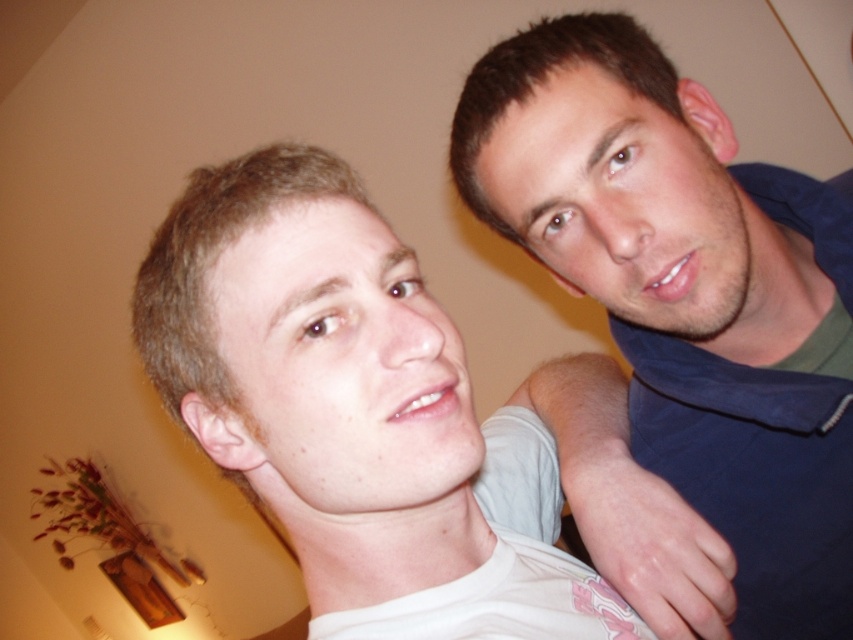
You are a photographer setting up a shoot in this scene. You need to place a spotlight on the right side of the blue cotton shirt at upper right and another on the left side of the white matte shirt at center. Will the spotlights overlap if they are both placed 1 meter away from their respective shirts?

The blue cotton shirt at upper right is positioned on the right side of the white matte shirt at center. Since the shirts are positioned side by side with the blue cotton shirt at upper right to the right of the white matte shirt at center, placing spotlights 1 meter away from each would mean the spotlights would be on opposite sides of the shirts. Therefore, the spotlights will not overlap.

You are a photographer setting up for a portrait session. You need to ensure that the two people in the image are positioned so that their faces are exactly 50 centimeters apart for proper lighting. Based on the current positioning of the blue cotton shirt at upper right and the other person, do you need to adjust their positions?

The two people are currently 46.56 centimeters apart. Since the required distance is 50 centimeters, they need to move slightly apart to achieve the desired separation for proper lighting.

You are designing a layout for a clothing catalog and need to place the blue cotton shirt at upper right and the white matte shirt at center. Given their sizes, which shirt should be placed higher to maintain visual balance?

The blue cotton shirt at upper right has a greater height compared to the white matte shirt at center. To maintain visual balance, the taller blue cotton shirt at upper right should be placed higher so that its center aligns with the center of the shorter white matte shirt at center.